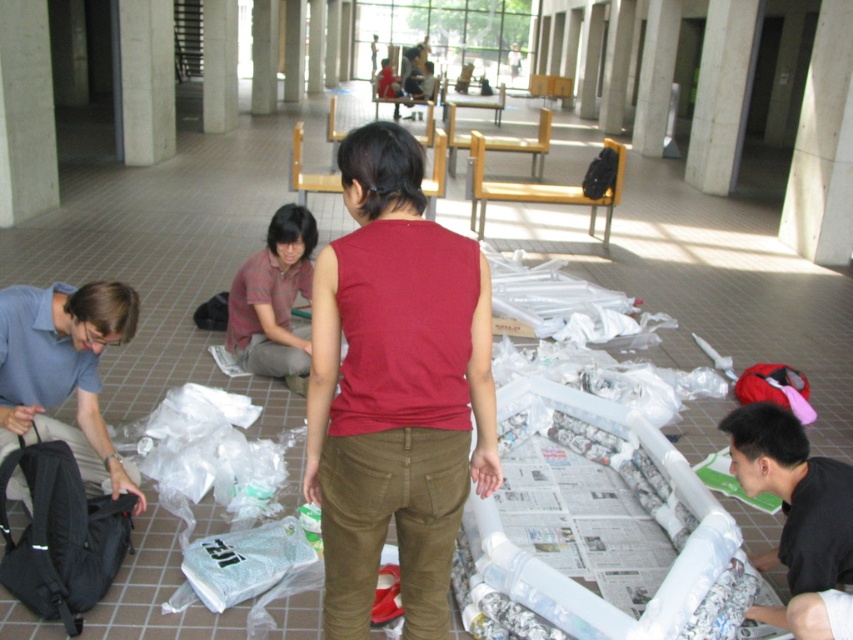
Question: Does concrete at left have a lesser width compared to black fabric bag at lower left?

Choices:
 (A) no
 (B) yes

Answer: (A)

Question: Which point is closer to the camera?

Choices:
 (A) (20, 90)
 (B) (49, 508)
 (C) (267, 260)

Answer: (B)

Question: Is white concrete pillar at upper left further to camera compared to black matte backpack at center?

Choices:
 (A) no
 (B) yes

Answer: (B)

Question: Which of the following is the closest to the observer?

Choices:
 (A) matte red sleeveless shirt at center
 (B) black fabric backpack at lower left

Answer: (A)

Question: Which object is closer to the camera taking this photo?

Choices:
 (A) striped cotton shirt at center
 (B) white concrete pillar at upper center

Answer: (A)

Question: Is white concrete pillar at upper left to the right of white concrete pillar at upper center from the viewer's perspective?

Choices:
 (A) yes
 (B) no

Answer: (A)